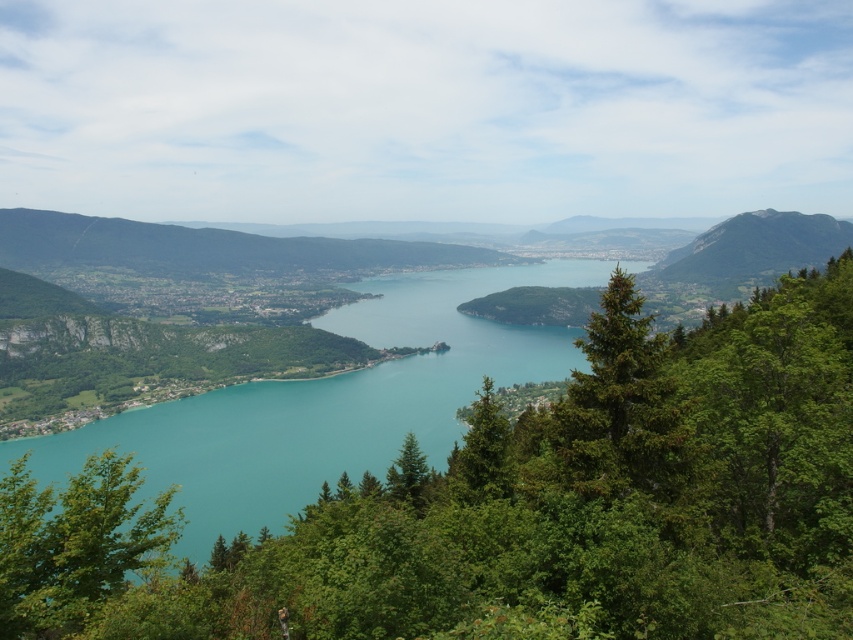
Is green leafy tree at lower left further to camera compared to green needle-like tree at center-right?

No, it is not.

Is green leafy tree at lower left thinner than green needle-like tree at center-right?

No.

Does point (74, 588) come behind point (633, 445)?

No, it is in front of (633, 445).

The width and height of the screenshot is (853, 640). Identify the location of green leafy tree at lower left. (73, 544).

Find the location of a particular element. The image size is (853, 640). green leafy tree at center is located at coordinates (517, 506).

Who is positioned more to the right, green leafy tree at center or green needle-like tree at center-right?

green needle-like tree at center-right

Between point (605, 339) and point (560, 470), which one is positioned behind?

The point (605, 339) is behind.

Image resolution: width=853 pixels, height=640 pixels. In order to click on green leafy tree at center in this screenshot , I will do `click(517, 506)`.

Does green leafy tree at center have a greater height compared to green leafy tree at lower left?

Yes, green leafy tree at center is taller than green leafy tree at lower left.

Can you confirm if green leafy tree at center is positioned below green leafy tree at lower left?

No, green leafy tree at center is not below green leafy tree at lower left.

Does point (158, 568) come closer to viewer compared to point (64, 625)?

No.

Locate an element on the screen. This screenshot has width=853, height=640. green leafy tree at center is located at coordinates pos(517,506).